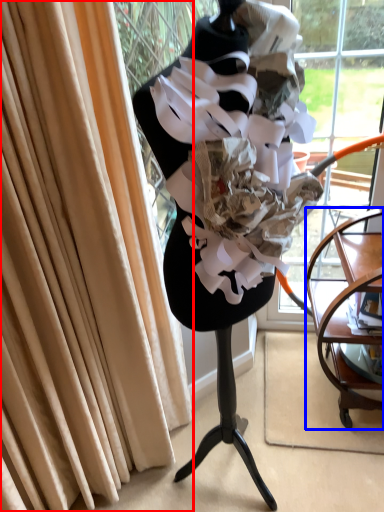
Question: Which object is further to the camera taking this photo, curtain (highlighted by a red box) or furniture (highlighted by a blue box)?

Choices:
 (A) curtain
 (B) furniture

Answer: (B)